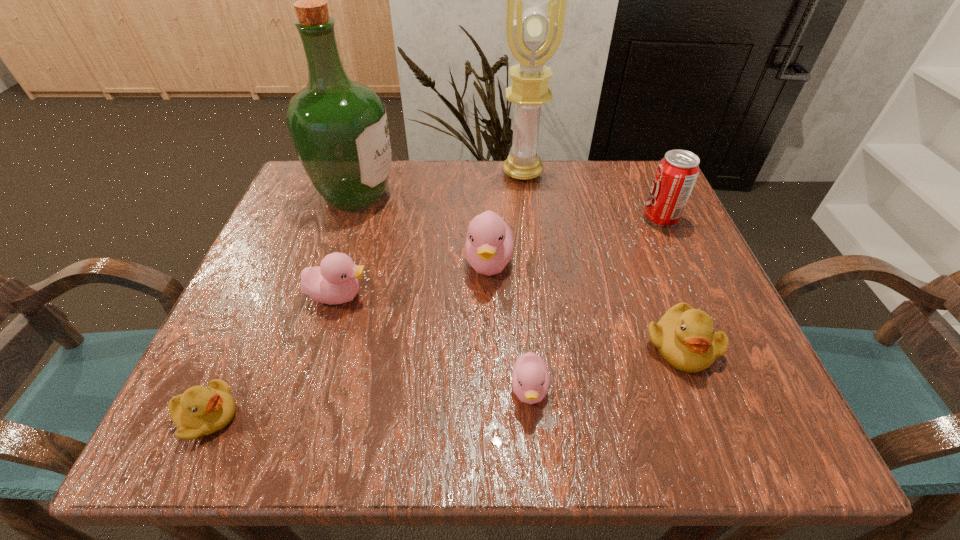
Find the location of `free region at the right edge of the desktop`. free region at the right edge of the desktop is located at coordinates (669, 248).

In the image, there is a desktop. Where is `vacant space at the far right corner`? The height and width of the screenshot is (540, 960). vacant space at the far right corner is located at coordinates (632, 183).

What are the coordinates of `vacant space that's between the liquor and the soda` in the screenshot? It's located at (508, 206).

This screenshot has width=960, height=540. In order to click on vacant space in between the fourth tallest object and the liquor in this screenshot , I will do `click(422, 228)`.

You are a GUI agent. You are given a task and a screenshot of the screen. Output one action in this format:
    pyautogui.click(x=<x>, y=<y>)
    Task: Click on the free spot between the soda and the award
    This screenshot has height=540, width=960.
    Given the screenshot: What is the action you would take?
    pyautogui.click(x=591, y=195)

Identify the location of vacant point located between the tallest duckling and the rightmost duckling. (585, 305).

Find the location of `free area in between the green liquor and the bigger yellow duckling`. free area in between the green liquor and the bigger yellow duckling is located at coordinates (518, 270).

Image resolution: width=960 pixels, height=540 pixels. In order to click on vacant space in between the right yellow duckling and the smallest pink duckling in this screenshot , I will do `click(605, 368)`.

Locate an element on the screen. The image size is (960, 540). vacant space in between the liquor and the leftmost duckling is located at coordinates (282, 305).

I want to click on vacant space in between the award and the liquor, so click(440, 184).